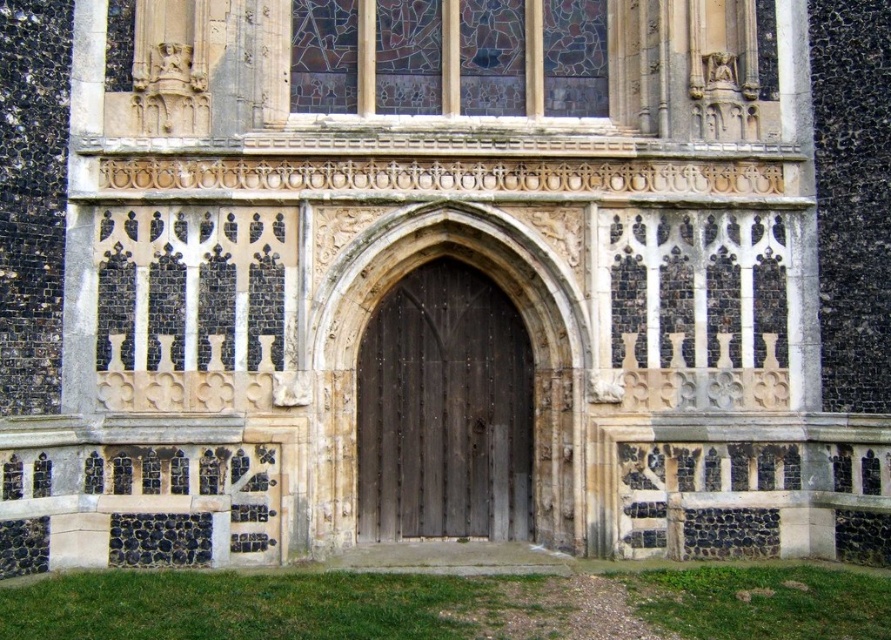
Who is shorter, dark wood door at center or stained glass at upper center?

With less height is stained glass at upper center.

Can you confirm if dark wood door at center is positioned to the right of stained glass at upper center?

Incorrect, dark wood door at center is not on the right side of stained glass at upper center.

Which is in front, point (456, 273) or point (383, 67)?

Positioned in front is point (456, 273).

Locate an element on the screen. dark wood door at center is located at coordinates 444,410.